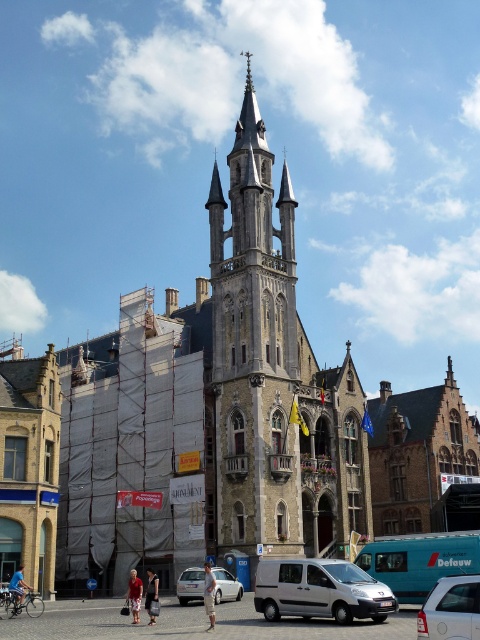
You are a delivery person standing in front of the historic building and need to park your silver metallic van at center. There is a red cotton shorts at lower center blocking the parking spot. Can you estimate if the van can fit into the parking spot without moving the shorts?

The silver metallic van at center might be wider than red cotton shorts at lower center, so it is uncertain if the van can fit without moving the shorts. It is safer to move the shorts first.

You are a photographer standing in the town square and want to capture both the silver metallic hatchback at center and the light brown leather pants at center in a single frame. Based on their positions, which object should you adjust your camera angle to focus on first to ensure both are in the shot?

Since the silver metallic hatchback at center is to the left of the light brown leather pants at center, you should adjust your camera angle to focus on the silver metallic hatchback at center first to ensure both are included in the frame.